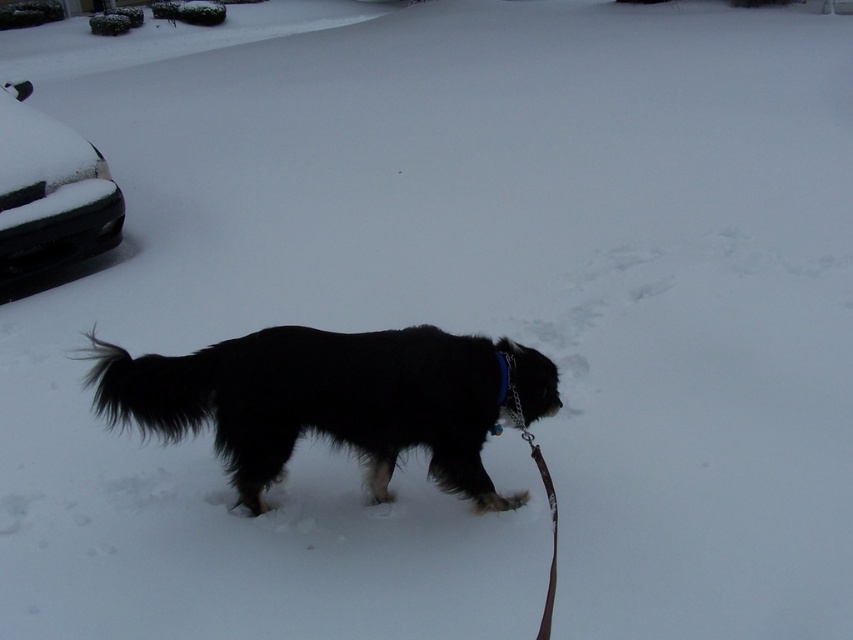
Between black fluffy dog at center and brown leather leash at lower center, which one has less height?

brown leather leash at lower center

Locate an element on the screen. The height and width of the screenshot is (640, 853). black fluffy dog at center is located at coordinates (331, 401).

Find the location of `black fluffy dog at center`. black fluffy dog at center is located at coordinates coord(331,401).

Between black fluffy dog at center and black glossy car at left, which one has more height?

Standing taller between the two is black glossy car at left.

Image resolution: width=853 pixels, height=640 pixels. What do you see at coordinates (331, 401) in the screenshot?
I see `black fluffy dog at center` at bounding box center [331, 401].

Between point (444, 376) and point (56, 173), which one is positioned behind?

Positioned behind is point (56, 173).

Image resolution: width=853 pixels, height=640 pixels. I want to click on black fluffy dog at center, so (331, 401).

Between point (99, 176) and point (553, 508), which one is positioned in front?

Positioned in front is point (553, 508).

Is black glossy car at left wider than brown leather leash at lower center?

Indeed, black glossy car at left has a greater width compared to brown leather leash at lower center.

At what (x,y) coordinates should I click in order to perform the action: click on black glossy car at left. Please return your answer as a coordinate pair (x, y). The image size is (853, 640). Looking at the image, I should click on 49,193.